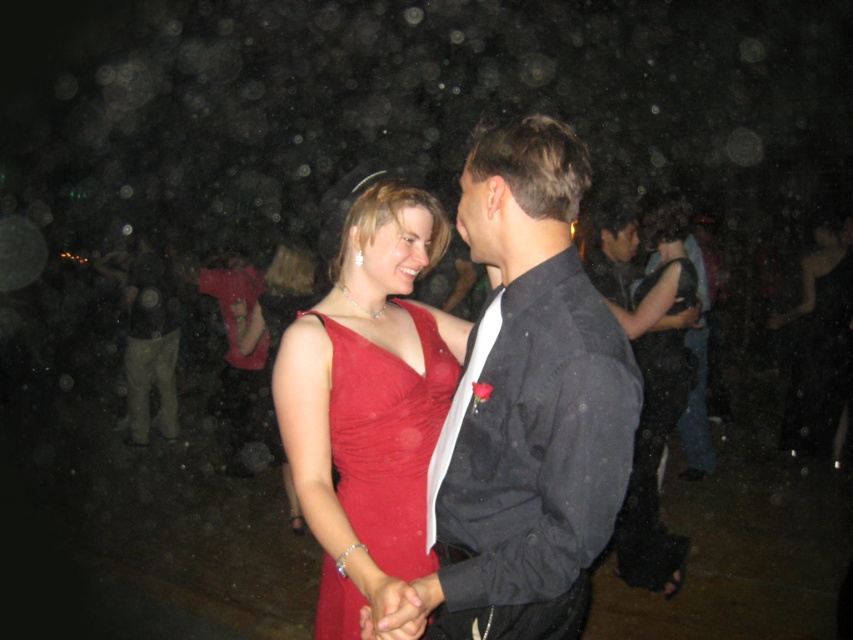
You are a photographer at the event and want to capture a closeup shot of both the shiny black suit at center and the matte red dress at center without moving the subjects. Given the camera lens you have, which can only focus on objects occupying the same amount of space in the frame, will you be able to do this?

The shiny black suit at center occupies less space than matte red dress at center, so the objects do not occupy the same amount of space in the frame. Therefore, the photographer cannot capture a closeup shot of both the shiny black suit at center and the matte red dress at center without moving the subjects.

You are a photographer at the event and want to capture a photo of the shiny black suit at center and the matte red dress at center. Based on their positions, which one is lower in the image?

The shiny black suit at center is below the matte red dress at center, so it is lower in the image.

You are a photographer at the event and want to capture a photo of the shiny black suit at center and the matte red dress at center. Since the camera can only focus on one subject at a time, which subject should you focus on to ensure the other is still visible but slightly blurred?

The shiny black suit at center is in front of the matte red dress at center, so you should focus on the shiny black suit at center to keep it sharp while the matte red dress at center appears slightly blurred in the background.